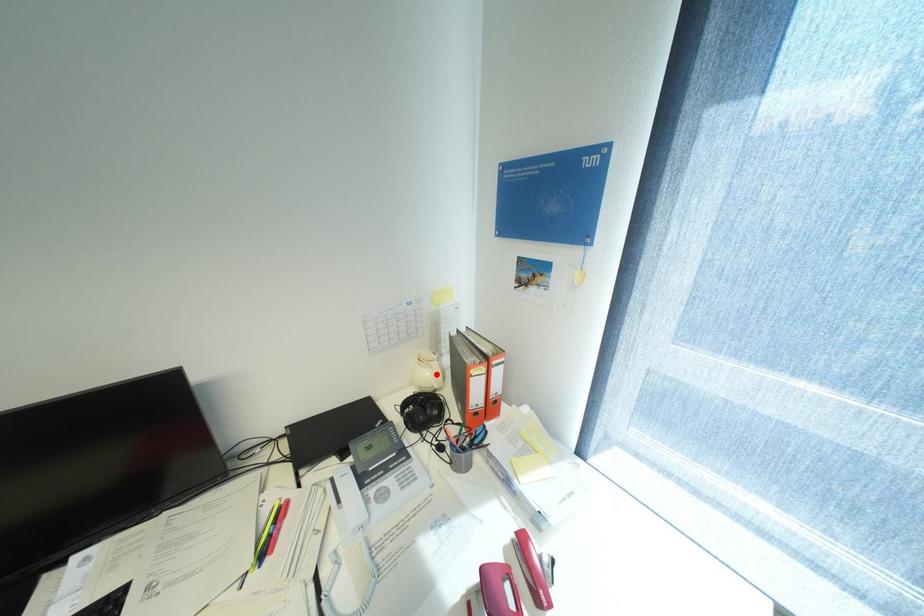
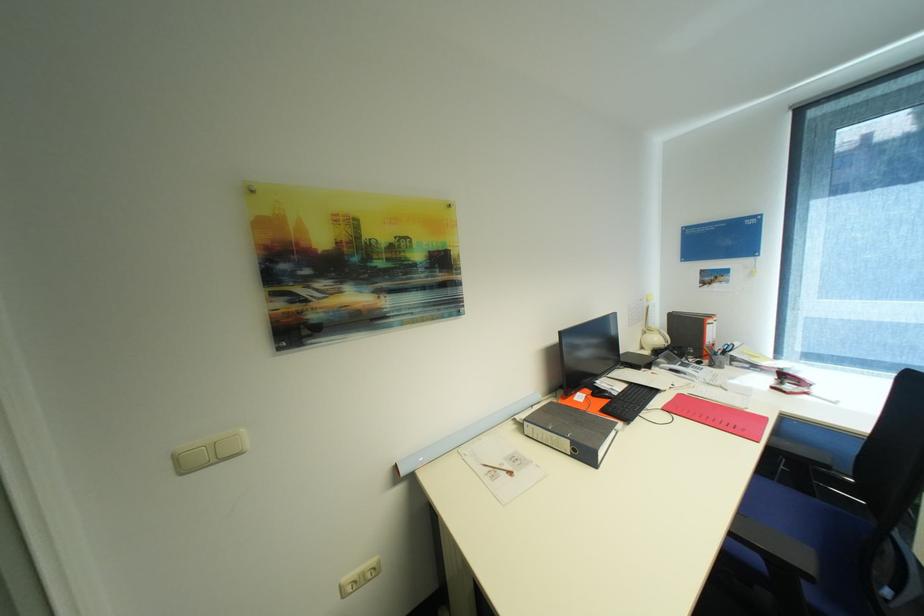
Where in the second image is the point corresponding to the highlighted location from the first image?

(663, 339)